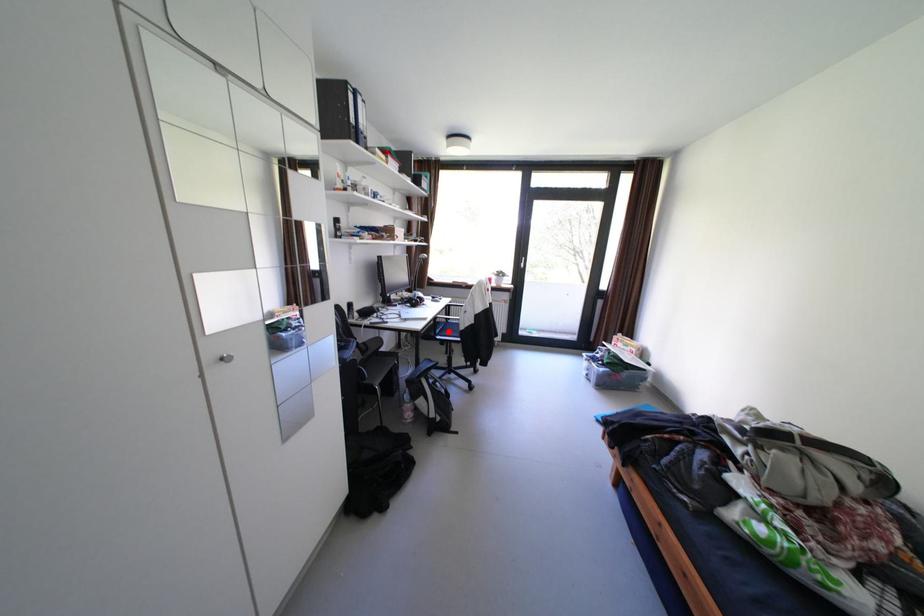
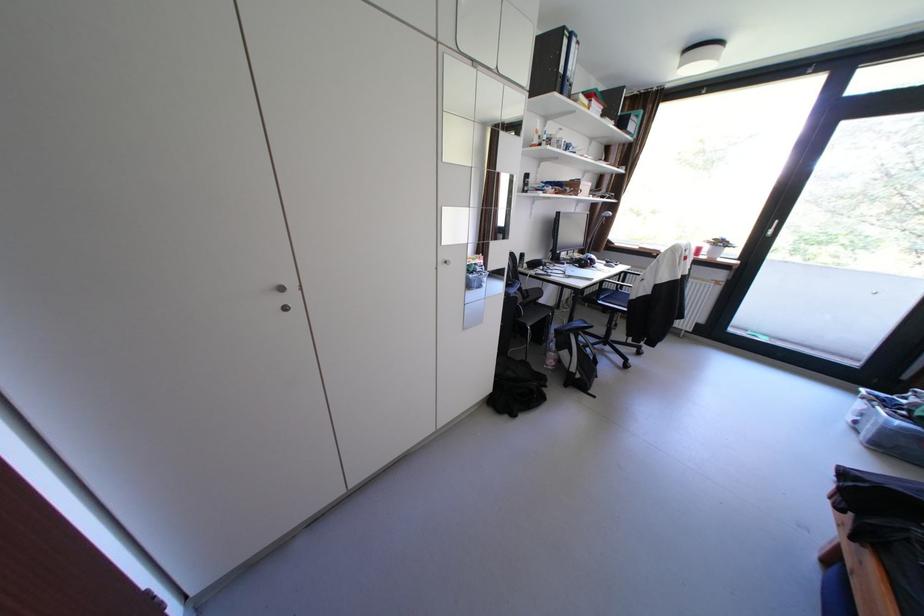
Question: I am providing you with two images of the same scene from different viewpoints. In image1, a red point is highlighted. Considering the same 3D point in image2, which of the following is correct?

Choices:
 (A) It is closer
 (B) It is farther

Answer: (B)